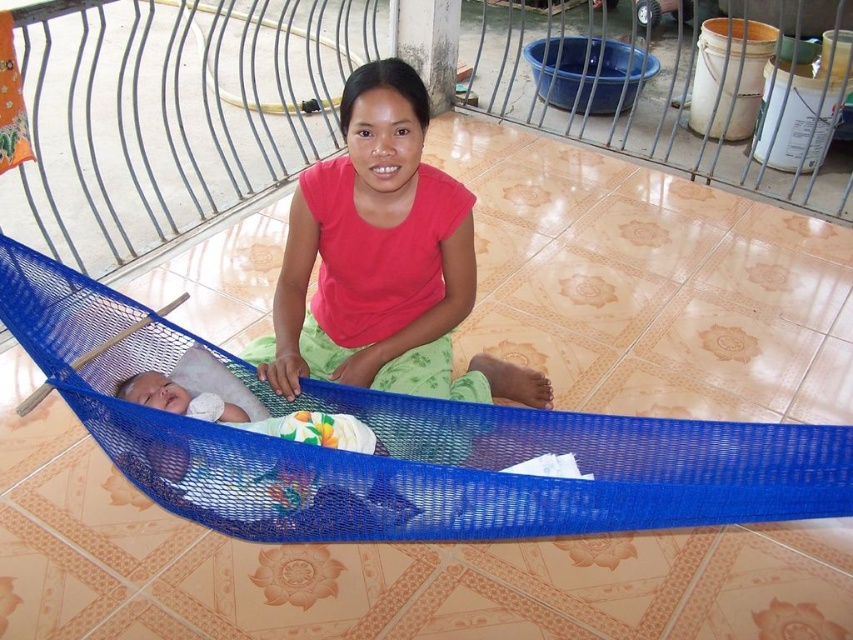
Question: Can you confirm if blue mesh hammock at center is thinner than white soft baby at lower left?

Choices:
 (A) no
 (B) yes

Answer: (A)

Question: Among these objects, which one is farthest from the camera?

Choices:
 (A) white soft diaper at center
 (B) blue mesh hammock at center

Answer: (A)

Question: Can you confirm if blue mesh hammock at center is thinner than white soft baby at lower left?

Choices:
 (A) no
 (B) yes

Answer: (A)

Question: Which object is positioned closest to the white soft baby at lower left?

Choices:
 (A) white soft baby at center
 (B) white soft diaper at center
 (C) blue mesh hammock at center

Answer: (B)

Question: Among these objects, which one is nearest to the camera?

Choices:
 (A) white soft baby at center
 (B) blue mesh hammock at center
 (C) white soft diaper at center

Answer: (B)

Question: Is white soft baby at center to the left of white soft diaper at center from the viewer's perspective?

Choices:
 (A) yes
 (B) no

Answer: (B)